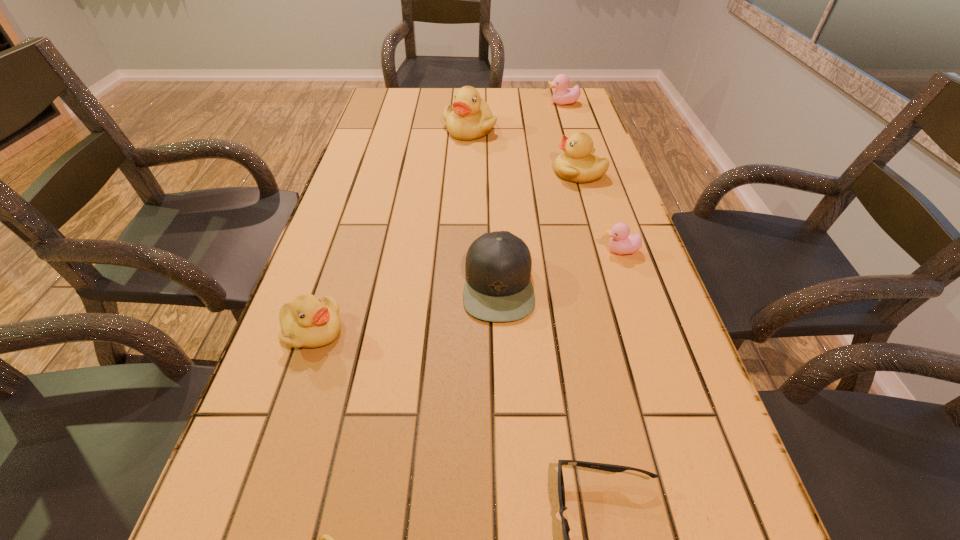
Locate an element on the screen. free region located on the brim of the cap is located at coordinates (441, 285).

Identify the location of free space located on the front-facing side of the second nearest duckling. (472, 330).

Image resolution: width=960 pixels, height=540 pixels. I want to click on vacant space located 0.130m on the front-facing side of the fourth farthest duckling, so click(547, 251).

Identify the location of vacant space located on the front-facing side of the fourth farthest duckling. (488, 251).

The image size is (960, 540). Identify the location of free location located 0.250m on the front-facing side of the fourth farthest duckling. (496, 251).

At what (x,y) coordinates should I click in order to perform the action: click on object present at the far edge. Please return your answer as a coordinate pair (x, y). The width and height of the screenshot is (960, 540). Looking at the image, I should click on (561, 96).

At what (x,y) coordinates should I click in order to perform the action: click on object situated at the left edge. Please return your answer as a coordinate pair (x, y). The image size is (960, 540). Looking at the image, I should click on (308, 322).

In order to click on object at the far right corner in this screenshot , I will do `click(561, 96)`.

Where is `free region at the far edge of the desktop`? The width and height of the screenshot is (960, 540). free region at the far edge of the desktop is located at coordinates (452, 94).

Identify the location of vacant space at the left edge of the desktop. This screenshot has height=540, width=960. (327, 264).